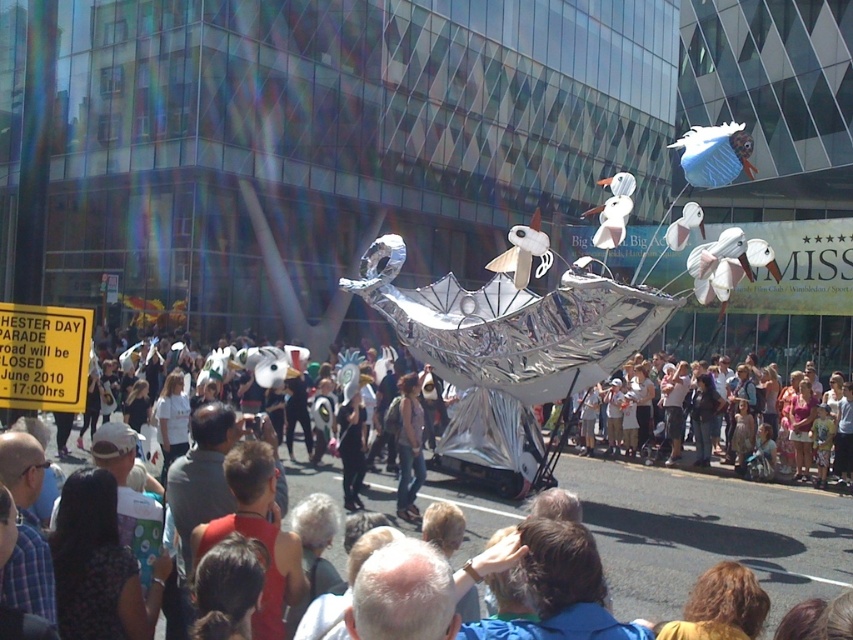
Which of these two, reflective silver umbrella at center or white cotton crowd at lower right, stands taller?

white cotton crowd at lower right is taller.

Does reflective silver umbrella at center have a greater width compared to white cotton crowd at lower right?

Yes.

Describe the element at coordinates (706, 532) in the screenshot. I see `reflective silver umbrella at center` at that location.

Find the location of a particular element. The width and height of the screenshot is (853, 640). reflective silver umbrella at center is located at coordinates (706, 532).